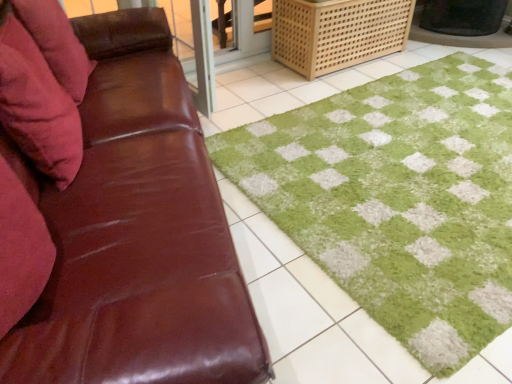
Question: Is the depth of velvety pink pillow at left, which ranks as the second pillow in front-to-back order, greater than that of light brown woven crate at upper right?

Choices:
 (A) no
 (B) yes

Answer: (A)

Question: From a real-world perspective, is velvety pink pillow at left, which ranks as the second pillow in front-to-back order, positioned over light brown woven crate at upper right based on gravity?

Choices:
 (A) yes
 (B) no

Answer: (A)

Question: Is velvety pink pillow at left, which is counted as the 1th pillow, starting from the back, shorter than light brown woven crate at upper right?

Choices:
 (A) yes
 (B) no

Answer: (A)

Question: Are velvety pink pillow at left, which is counted as the 1th pillow, starting from the back, and light brown woven crate at upper right making contact?

Choices:
 (A) no
 (B) yes

Answer: (A)

Question: Is velvety pink pillow at left, which is counted as the 1th pillow, starting from the back, closer to the viewer compared to light brown woven crate at upper right?

Choices:
 (A) yes
 (B) no

Answer: (A)

Question: Which is correct: velvet red pillow at left, which is counted as the second pillow, starting from the back, is inside brown leather couch at left, or outside of it?

Choices:
 (A) outside
 (B) inside

Answer: (B)

Question: In terms of size, does velvet red pillow at left, which is counted as the second pillow, starting from the back, appear bigger or smaller than brown leather couch at left?

Choices:
 (A) small
 (B) big

Answer: (A)

Question: Considering the positions of point (11, 115) and point (90, 107), is point (11, 115) closer or farther from the camera than point (90, 107)?

Choices:
 (A) closer
 (B) farther

Answer: (A)

Question: Is velvet red pillow at left, which is counted as the second pillow, starting from the back, in front of or behind brown leather couch at left in the image?

Choices:
 (A) front
 (B) behind

Answer: (B)

Question: Relative to green shaggy bath mat at center, is velvet red pillow at left, arranged as the first pillow when viewed from the front, in front or behind?

Choices:
 (A) behind
 (B) front

Answer: (B)

Question: Is velvet red pillow at left, arranged as the first pillow when viewed from the front, spatially inside green shaggy bath mat at center, or outside of it?

Choices:
 (A) inside
 (B) outside

Answer: (B)

Question: Is velvet red pillow at left, arranged as the first pillow when viewed from the front, taller or shorter than green shaggy bath mat at center?

Choices:
 (A) short
 (B) tall

Answer: (B)

Question: Considering the positions of velvet red pillow at left, which is counted as the second pillow, starting from the back, and green shaggy bath mat at center in the image, is velvet red pillow at left, which is counted as the second pillow, starting from the back, bigger or smaller than green shaggy bath mat at center?

Choices:
 (A) small
 (B) big

Answer: (A)

Question: From the image's perspective, is light brown woven crate at upper right located above or below green shaggy bath mat at center?

Choices:
 (A) above
 (B) below

Answer: (A)

Question: In terms of width, does light brown woven crate at upper right look wider or thinner when compared to green shaggy bath mat at center?

Choices:
 (A) wide
 (B) thin

Answer: (B)